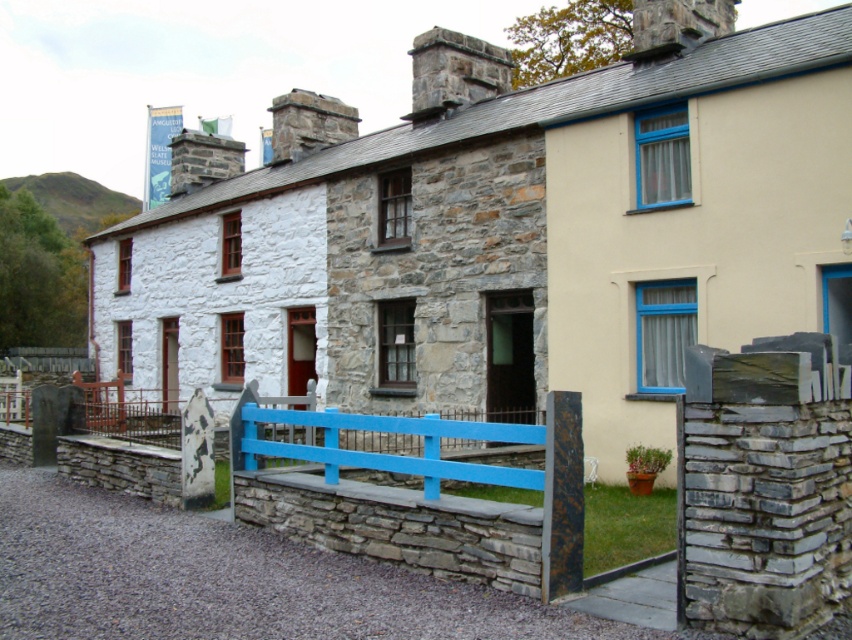
Question: Is stone cottage at center further to the viewer compared to blue painted wood fence at center?

Choices:
 (A) no
 (B) yes

Answer: (B)

Question: Can you confirm if blue painted wood fence at center is positioned above blue painted wood rail at center?

Choices:
 (A) yes
 (B) no

Answer: (B)

Question: Which of the following is the closest to the observer?

Choices:
 (A) blue painted wood rail at center
 (B) stone cottage at center

Answer: (A)

Question: Does stone cottage at center have a smaller size compared to blue painted wood fence at center?

Choices:
 (A) yes
 (B) no

Answer: (B)

Question: Which point is closer to the camera?

Choices:
 (A) (383, 467)
 (B) (681, 122)

Answer: (A)

Question: Which point is farther from the camera taking this photo?

Choices:
 (A) tap(360, 454)
 (B) tap(459, 141)

Answer: (B)